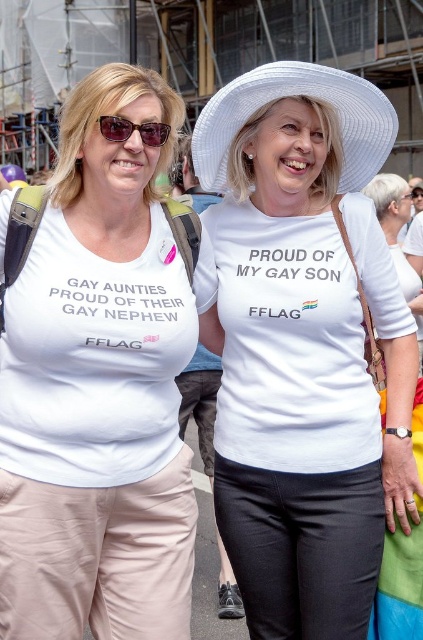
Question: Is white cotton shirt at center in front of matte black sunglasses at upper left?

Choices:
 (A) no
 (B) yes

Answer: (A)

Question: Can you confirm if white woven hat at upper center is positioned to the right of matte black sunglasses at upper left?

Choices:
 (A) no
 (B) yes

Answer: (B)

Question: Does white cotton shirt at center appear on the left side of white matte t-shirt at left?

Choices:
 (A) yes
 (B) no

Answer: (B)

Question: Among these points, which one is farthest from the camera?

Choices:
 (A) (58, 618)
 (B) (337, 515)
 (C) (379, 134)
 (D) (158, 140)

Answer: (C)

Question: Which point appears farthest from the camera in this image?

Choices:
 (A) (241, 506)
 (B) (200, 138)
 (C) (162, 131)

Answer: (B)

Question: Among these points, which one is farthest from the camera?

Choices:
 (A) (162, 145)
 (B) (294, 186)

Answer: (B)